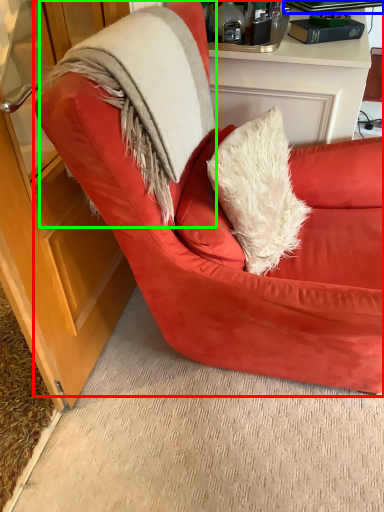
Question: Based on their relative distances, which object is nearer to chair (highlighted by a red box)? Choose from laptop (highlighted by a blue box) and fur coat (highlighted by a green box).

Choices:
 (A) laptop
 (B) fur coat

Answer: (B)